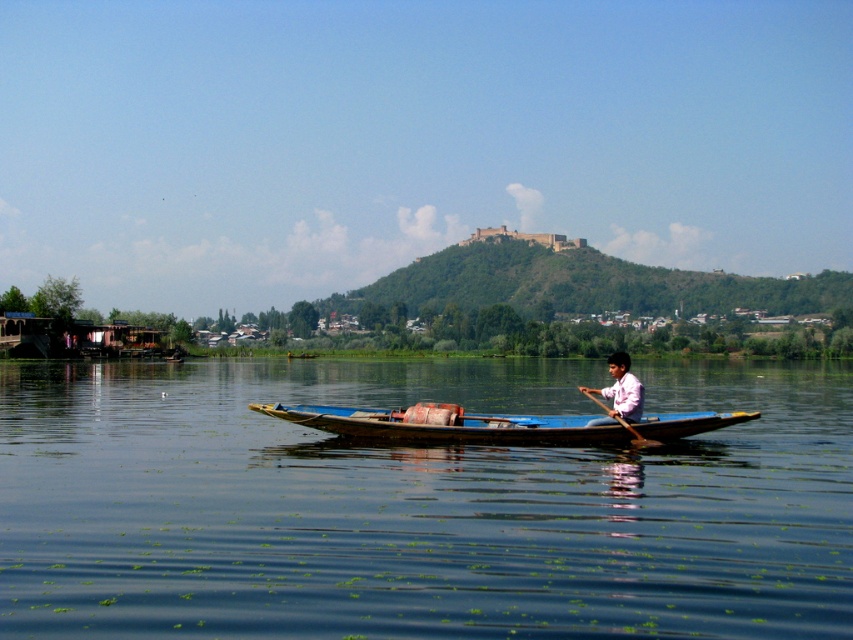
Between point (393, 426) and point (611, 392), which one is positioned behind?

Positioned behind is point (611, 392).

Does point (444, 432) come farther from viewer compared to point (622, 356)?

No, it is in front of (622, 356).

This screenshot has height=640, width=853. I want to click on blue wooden canoe at center, so click(x=448, y=426).

Does blue wooden boat at center lie in front of blue wooden canoe at center?

Yes, it is in front of blue wooden canoe at center.

The image size is (853, 640). Find the location of `blue wooden boat at center`. blue wooden boat at center is located at coordinates (416, 504).

Identify the location of blue wooden boat at center. (416, 504).

Is point (755, 388) closer to camera compared to point (643, 440)?

No, (755, 388) is behind (643, 440).

The image size is (853, 640). Find the location of `blue wooden boat at center`. blue wooden boat at center is located at coordinates (416, 504).

Who is more distant from viewer, (364, 493) or (637, 438)?

Positioned behind is point (637, 438).

Image resolution: width=853 pixels, height=640 pixels. Identify the location of blue wooden boat at center. (416, 504).